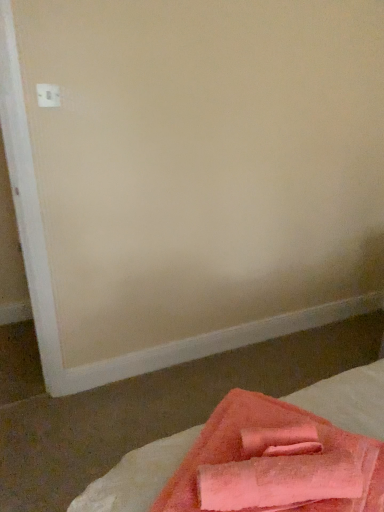
Question: Can you confirm if pink terry cloth towel at lower right is bigger than soft pink towel at lower right?

Choices:
 (A) yes
 (B) no

Answer: (B)

Question: Is pink terry cloth towel at lower right far away from soft pink towel at lower right?

Choices:
 (A) yes
 (B) no

Answer: (B)

Question: Does pink terry cloth towel at lower right turn towards soft pink towel at lower right?

Choices:
 (A) no
 (B) yes

Answer: (A)

Question: Is soft pink towel at lower right surrounded by pink terry cloth towel at lower right?

Choices:
 (A) yes
 (B) no

Answer: (B)

Question: Does pink terry cloth towel at lower right lie in front of soft pink towel at lower right?

Choices:
 (A) no
 (B) yes

Answer: (A)

Question: Would you say pink terry cloth towel at lower right is to the left or to the right of white plastic electric outlet at upper left in the picture?

Choices:
 (A) left
 (B) right

Answer: (B)

Question: Considering the positions of pink terry cloth towel at lower right and white plastic electric outlet at upper left in the image, is pink terry cloth towel at lower right taller or shorter than white plastic electric outlet at upper left?

Choices:
 (A) short
 (B) tall

Answer: (A)

Question: From a real-world perspective, is pink terry cloth towel at lower right above or below white plastic electric outlet at upper left?

Choices:
 (A) above
 (B) below

Answer: (B)

Question: In terms of size, does pink terry cloth towel at lower right appear bigger or smaller than white plastic electric outlet at upper left?

Choices:
 (A) big
 (B) small

Answer: (A)

Question: From a real-world perspective, is soft pink towel at lower right above or below pink terry cloth towel at lower right?

Choices:
 (A) below
 (B) above

Answer: (A)

Question: From their relative heights in the image, would you say soft pink towel at lower right is taller or shorter than pink terry cloth towel at lower right?

Choices:
 (A) short
 (B) tall

Answer: (B)

Question: Visually, is soft pink towel at lower right positioned to the left or to the right of pink terry cloth towel at lower right?

Choices:
 (A) right
 (B) left

Answer: (A)

Question: Is soft pink towel at lower right wider or thinner than pink terry cloth towel at lower right?

Choices:
 (A) wide
 (B) thin

Answer: (A)

Question: Is point (152, 481) closer or farther from the camera than point (49, 93)?

Choices:
 (A) closer
 (B) farther

Answer: (A)

Question: Considering the positions of soft pink towel at lower right and white plastic electric outlet at upper left in the image, is soft pink towel at lower right wider or thinner than white plastic electric outlet at upper left?

Choices:
 (A) wide
 (B) thin

Answer: (A)